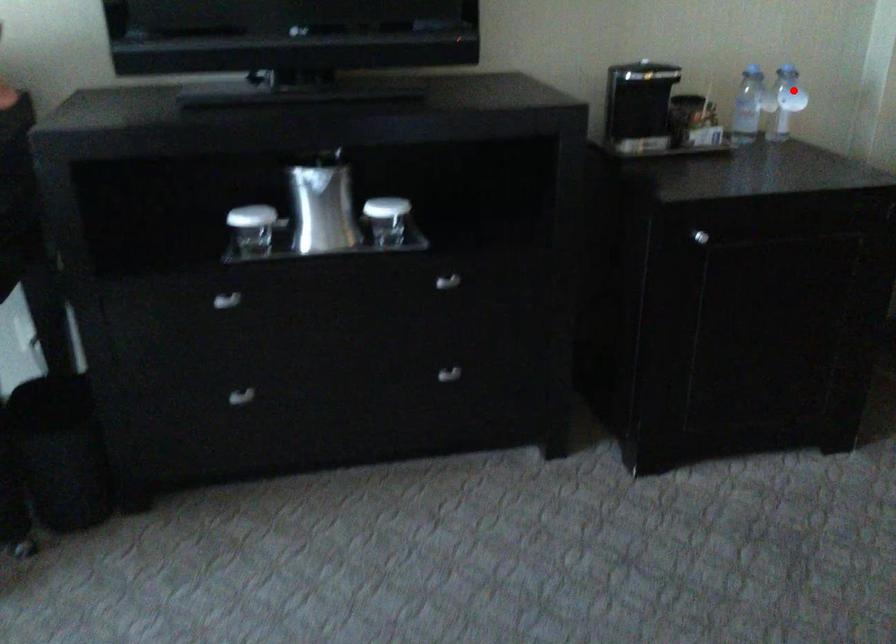
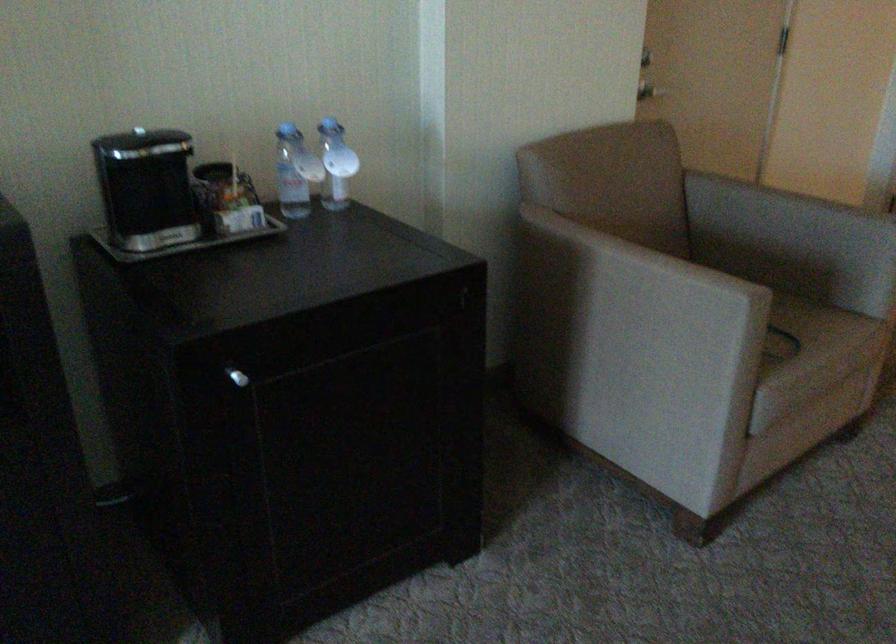
Question: I am providing you with two images of the same scene from different viewpoints. Image1 has a red point marked. In image2, the corresponding 3D location appears at what relative position? Reply with the corresponding letter.

Choices:
 (A) Closer
 (B) Farther

Answer: (A)